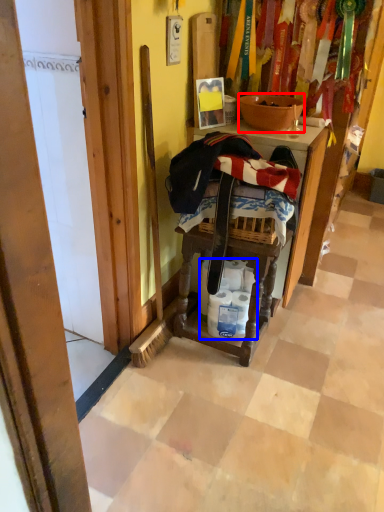
Question: Which object is closer to the camera taking this photo, bowl (highlighted by a red box) or toilet paper (highlighted by a blue box)?

Choices:
 (A) bowl
 (B) toilet paper

Answer: (A)